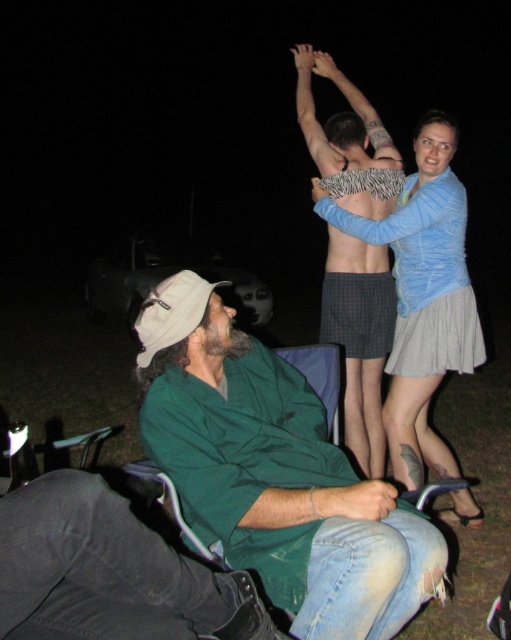
Question: Which object is positioned farthest from the light blue fabric skirt at upper right?

Choices:
 (A) zebra-patterned fabric at center
 (B) green cotton shirt at lower left
 (C) zebra print arm at upper center

Answer: (A)

Question: Is green cotton shirt at lower left bigger than light blue fabric skirt at upper right?

Choices:
 (A) no
 (B) yes

Answer: (A)

Question: Which object appears closest to the camera in this image?

Choices:
 (A) zebra print arm at upper center
 (B) zebra-patterned fabric at center
 (C) light blue fabric skirt at upper right

Answer: (A)

Question: Which of the following is the farthest from the observer?

Choices:
 (A) (411, 204)
 (B) (339, 124)
 (C) (334, 545)
 (D) (434, 445)

Answer: (B)

Question: Is green cotton shirt at lower left to the left of zebra-patterned fabric at center from the viewer's perspective?

Choices:
 (A) yes
 (B) no

Answer: (A)

Question: Is green cotton shirt at lower left wider than zebra print arm at upper center?

Choices:
 (A) yes
 (B) no

Answer: (A)